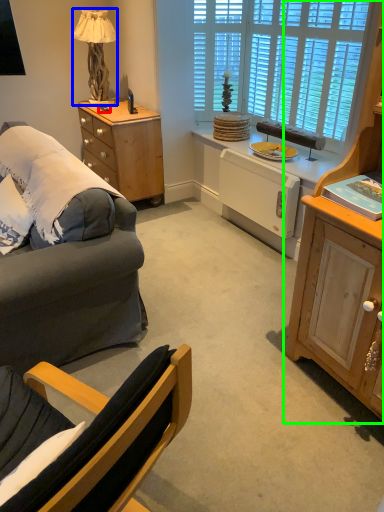
Question: Based on their relative distances, which object is nearer to remote control (highlighted by a red box)? Choose from lamp (highlighted by a blue box) and cabinetry (highlighted by a green box).

Choices:
 (A) lamp
 (B) cabinetry

Answer: (A)